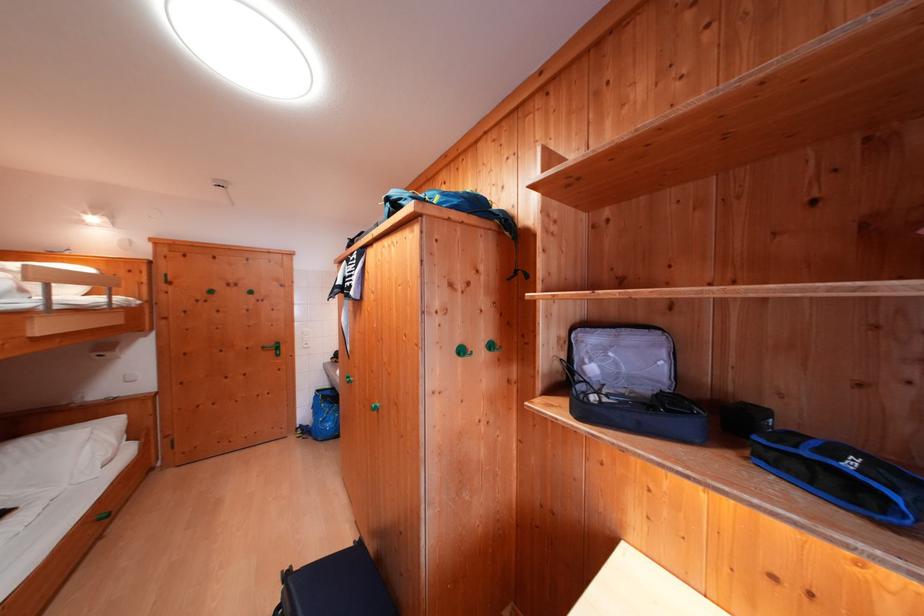
Where is `green wall hook`? The image size is (924, 616). green wall hook is located at coordinates (463, 351).